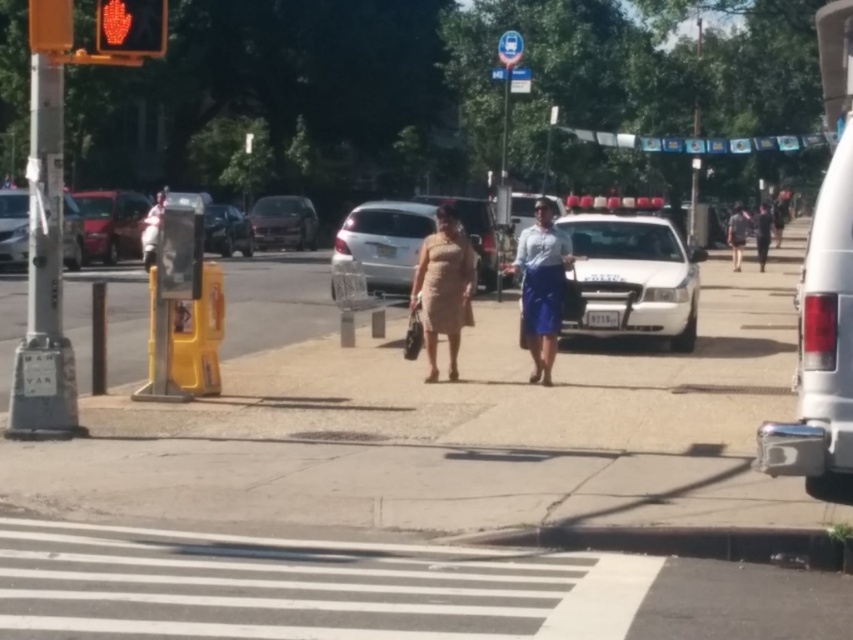
Question: Which point is closer to the camera taking this photo?

Choices:
 (A) (415, 276)
 (B) (631, 326)
 (C) (144, 38)
 (D) (782, 435)

Answer: (D)

Question: Which is farther from the dark blue jeans at center?

Choices:
 (A) blue satin skirt at center
 (B) metallic red car at left
 (C) matte beige dress at center
 (D) gray concrete sidewalk at center

Answer: (C)

Question: Where is white asphalt at center located in relation to white glossy police car at center in the image?

Choices:
 (A) below
 (B) above

Answer: (A)

Question: Is gray concrete sidewalk at center below metallic red car at left?

Choices:
 (A) yes
 (B) no

Answer: (A)

Question: Which object appears closest to the camera in this image?

Choices:
 (A) shiny black sedan at center
 (B) dark blue jeans at center

Answer: (A)

Question: Does matte beige dress at center have a greater width compared to shiny silver sedan at center?

Choices:
 (A) no
 (B) yes

Answer: (B)